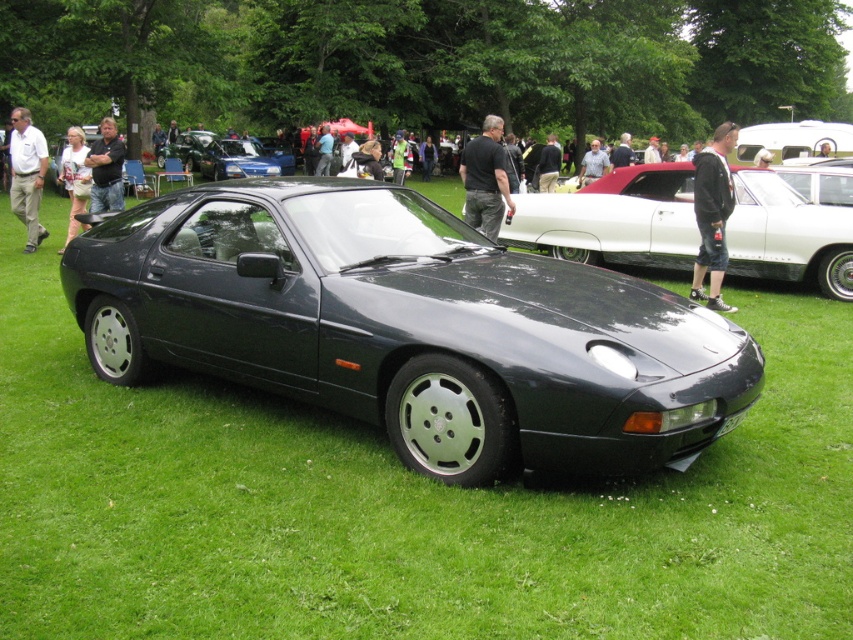
Is satin black car at center to the right of black fabric shirt at center from the viewer's perspective?

In fact, satin black car at center is to the left of black fabric shirt at center.

Which is in front, point (532, 314) or point (495, 204)?

Point (532, 314) is in front.

What are the coordinates of `satin black car at center` in the screenshot? It's located at (409, 326).

Is metallic silver car at center above white cotton shirt at left?

Incorrect, metallic silver car at center is not positioned above white cotton shirt at left.

Is metallic silver car at center further to the viewer compared to white cotton shirt at left?

No.

Does point (639, 227) lie in front of point (85, 227)?

Yes, point (639, 227) is in front of point (85, 227).

The image size is (853, 640). What are the coordinates of `metallic silver car at center` in the screenshot? It's located at (614, 220).

Which is in front, point (387, 275) or point (74, 230)?

Positioned in front is point (387, 275).

Is point (560, 298) positioned after point (68, 241)?

No, (560, 298) is in front of (68, 241).

What do you see at coordinates (409, 326) in the screenshot? The width and height of the screenshot is (853, 640). I see `satin black car at center` at bounding box center [409, 326].

In order to click on satin black car at center in this screenshot , I will do `click(409, 326)`.